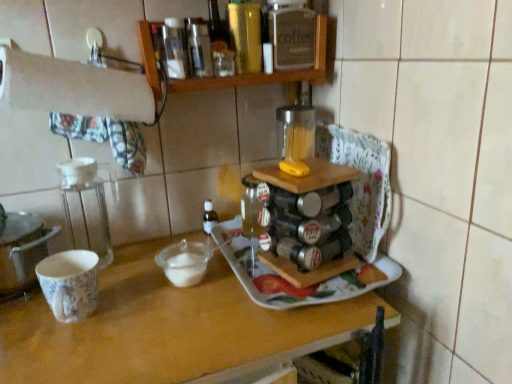
Question: Does transparent plastic container at left have a lesser height compared to transparent glass mixing bowl at center?

Choices:
 (A) no
 (B) yes

Answer: (A)

Question: Could you tell me if transparent plastic container at left is facing transparent glass mixing bowl at center?

Choices:
 (A) no
 (B) yes

Answer: (A)

Question: Considering the relative sizes of transparent plastic container at left and transparent glass mixing bowl at center in the image provided, is transparent plastic container at left wider than transparent glass mixing bowl at center?

Choices:
 (A) no
 (B) yes

Answer: (A)

Question: Is the position of transparent plastic container at left more distant than that of transparent glass mixing bowl at center?

Choices:
 (A) no
 (B) yes

Answer: (B)

Question: From the image's perspective, is transparent plastic container at left located above transparent glass mixing bowl at center?

Choices:
 (A) yes
 (B) no

Answer: (A)

Question: Is transparent plastic container at left turned away from transparent glass mixing bowl at center?

Choices:
 (A) yes
 (B) no

Answer: (B)

Question: Does wooden spice rack at upper center have a lesser height compared to wooden tray at center?

Choices:
 (A) no
 (B) yes

Answer: (B)

Question: Considering the relative positions of wooden spice rack at upper center and wooden tray at center in the image provided, is wooden spice rack at upper center to the left of wooden tray at center from the viewer's perspective?

Choices:
 (A) yes
 (B) no

Answer: (B)

Question: Is wooden tray at center surrounded by wooden spice rack at upper center?

Choices:
 (A) no
 (B) yes

Answer: (A)

Question: Is wooden spice rack at upper center outside wooden tray at center?

Choices:
 (A) yes
 (B) no

Answer: (A)

Question: Does wooden spice rack at upper center have a lesser width compared to wooden tray at center?

Choices:
 (A) yes
 (B) no

Answer: (A)

Question: Is wooden spice rack at upper center far from wooden tray at center?

Choices:
 (A) no
 (B) yes

Answer: (A)

Question: Is porcelain floral mug at left to the right of wooden spice rack at upper center from the viewer's perspective?

Choices:
 (A) yes
 (B) no

Answer: (B)